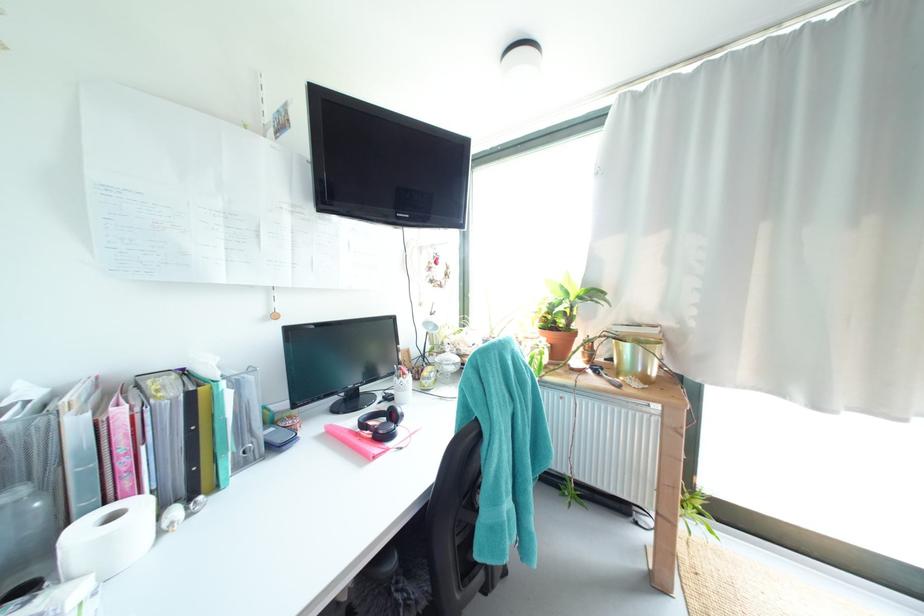
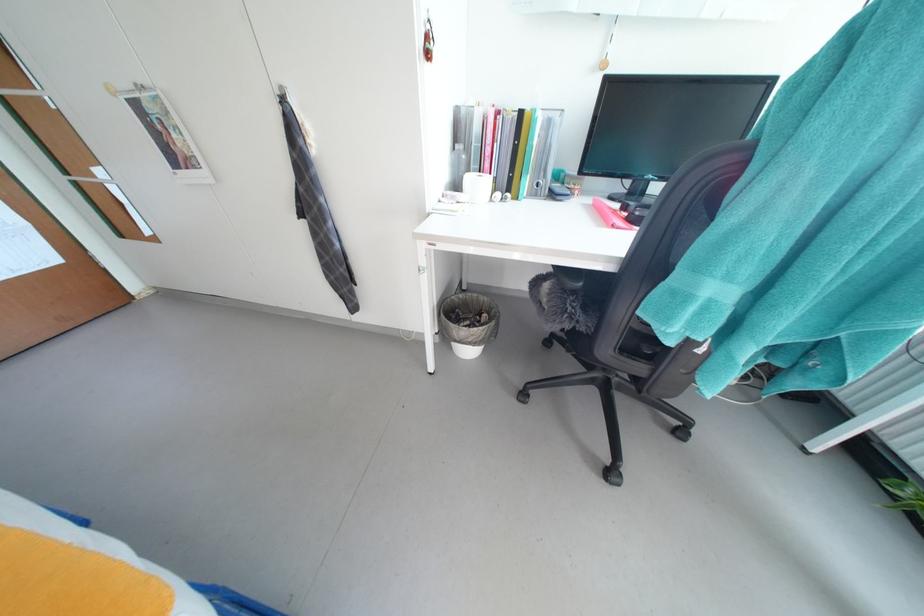
First-person continuous shooting, in which direction is the camera rotating?

The rotation direction of the camera is left-down.